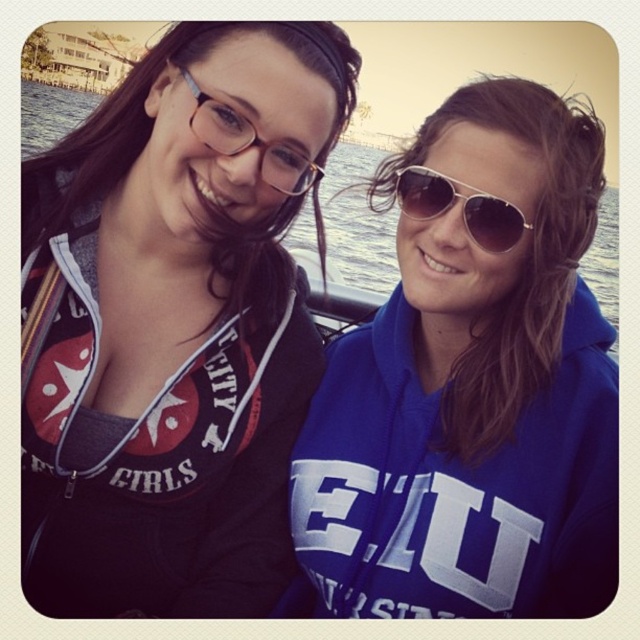
You are trying to determine if the matte black hoodie at left can fully cover the sunglasses at center without any part of the sunglasses being visible. Based on their sizes, is this possible?

The matte black hoodie at left is larger in size than the sunglasses at center, so it is possible for the matte black hoodie at left to fully cover the sunglasses at center without any part being visible.

You are a photographer trying to capture a clear shot of the matte black hoodie at left and the sunglasses at center. Based on their positions, which object should you focus on first to ensure both are in focus without adjusting the camera settings?

The matte black hoodie at left is taller than the sunglasses at center, so focusing on the matte black hoodie at left first will ensure both objects are in focus since it is the larger object in the frame.